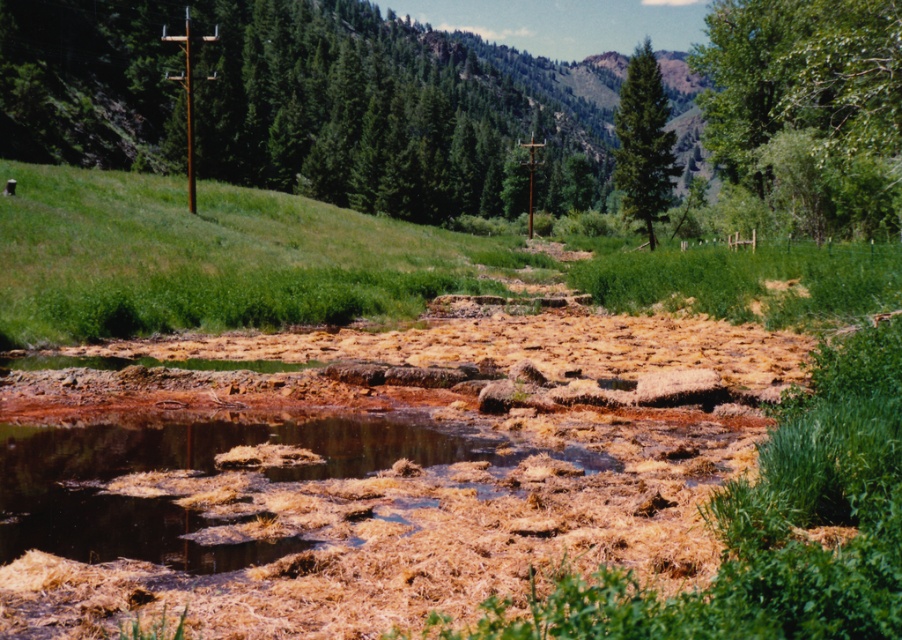
Question: Which point appears closest to the camera in this image?

Choices:
 (A) (632, 204)
 (B) (155, 540)

Answer: (B)

Question: Is brown organic debris at center smaller than green matte tree at upper center?

Choices:
 (A) no
 (B) yes

Answer: (B)

Question: Where is brown organic debris at center located in relation to green matte tree at upper center in the image?

Choices:
 (A) right
 (B) left

Answer: (B)

Question: Considering the relative positions of brown organic debris at center and green matte tree at upper center in the image provided, where is brown organic debris at center located with respect to green matte tree at upper center?

Choices:
 (A) right
 (B) left

Answer: (B)

Question: Among these objects, which one is nearest to the camera?

Choices:
 (A) green matte tree at upper center
 (B) brown organic debris at center

Answer: (B)